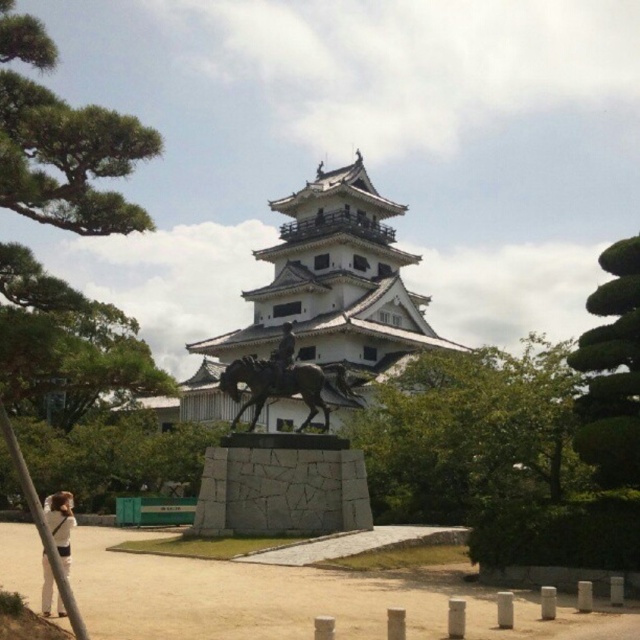
Who is positioned more to the right, green leafy tree at center or green leafy tree at center right?

green leafy tree at center

Based on the photo, does green leafy tree at center appear under green leafy tree at center right?

Correct, green leafy tree at center is located below green leafy tree at center right.

Does point (396, 442) come in front of point (630, 433)?

No, (396, 442) is further to viewer.

Where is `green leafy tree at center`? This screenshot has height=640, width=640. green leafy tree at center is located at coordinates (468, 429).

Who is positioned more to the left, green leafy tree at lower left or shiny bronze horse at center?

Positioned to the left is green leafy tree at lower left.

The height and width of the screenshot is (640, 640). What do you see at coordinates (113, 456) in the screenshot?
I see `green leafy tree at lower left` at bounding box center [113, 456].

Which is in front, point (131, 483) or point (273, 365)?

Point (273, 365) is more forward.

I want to click on green leafy tree at lower left, so click(x=113, y=456).

Which is more to the left, green leafy tree at center or shiny bronze horse at center?

Positioned to the left is shiny bronze horse at center.

Find the location of a particular element. green leafy tree at center is located at coordinates (468, 429).

At what (x,y) coordinates should I click in order to perform the action: click on green leafy tree at center. Please return your answer as a coordinate pair (x, y). The height and width of the screenshot is (640, 640). Looking at the image, I should click on (468, 429).

Where is `green leafy tree at center`? Image resolution: width=640 pixels, height=640 pixels. green leafy tree at center is located at coordinates click(468, 429).